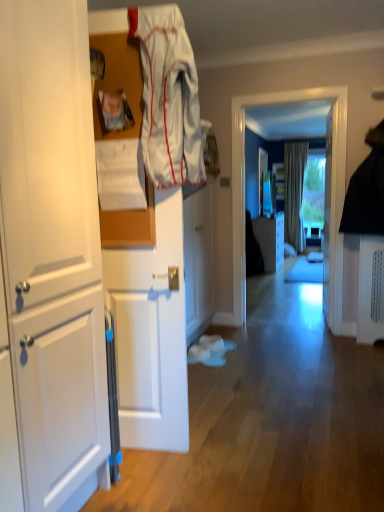
Question: Should I look upward or downward to see matte white cabinet at center, acting as the 1th cabinetry starting from the back?

Choices:
 (A) down
 (B) up

Answer: (B)

Question: From the image's perspective, is matte white cabinet at center, which ranks as the 3th cabinetry in left-to-right order, above transparent glass window at center?

Choices:
 (A) no
 (B) yes

Answer: (A)

Question: Considering the relative sizes of matte white cabinet at center, acting as the 1th cabinetry starting from the back, and transparent glass window at center in the image provided, is matte white cabinet at center, acting as the 1th cabinetry starting from the back, taller than transparent glass window at center?

Choices:
 (A) no
 (B) yes

Answer: (A)

Question: Does matte white cabinet at center, placed as the first cabinetry when sorted from right to left, have a larger size compared to transparent glass window at center?

Choices:
 (A) no
 (B) yes

Answer: (B)

Question: From the image's perspective, is matte white cabinet at center, acting as the 1th cabinetry starting from the back, located beneath transparent glass window at center?

Choices:
 (A) no
 (B) yes

Answer: (B)

Question: Considering the relative positions of matte white cabinet at center, acting as the 1th cabinetry starting from the back, and transparent glass window at center in the image provided, is matte white cabinet at center, acting as the 1th cabinetry starting from the back, to the left of transparent glass window at center from the viewer's perspective?

Choices:
 (A) yes
 (B) no

Answer: (B)

Question: From a real-world perspective, is matte white cabinet at center, the third cabinetry from the front, on transparent glass window at center?

Choices:
 (A) no
 (B) yes

Answer: (A)

Question: Is white matte cabinet at left, placed as the 1th cabinetry when sorted from front to back, surrounded by matte white cabinet at center, placed as the first cabinetry when sorted from right to left?

Choices:
 (A) yes
 (B) no

Answer: (B)

Question: From a real-world perspective, is matte white cabinet at center, acting as the 1th cabinetry starting from the back, located beneath white matte cabinet at left, the 3th cabinetry viewed from the right?

Choices:
 (A) no
 (B) yes

Answer: (B)

Question: Does matte white cabinet at center, placed as the first cabinetry when sorted from right to left, turn towards white matte cabinet at left, the 1th cabinetry when ordered from left to right?

Choices:
 (A) no
 (B) yes

Answer: (A)

Question: Is matte white cabinet at center, placed as the first cabinetry when sorted from right to left, behind white matte cabinet at left, marked as the 3th cabinetry in a back-to-front arrangement?

Choices:
 (A) no
 (B) yes

Answer: (B)

Question: Is matte white cabinet at center, placed as the first cabinetry when sorted from right to left, far from white matte cabinet at left, marked as the 3th cabinetry in a back-to-front arrangement?

Choices:
 (A) yes
 (B) no

Answer: (A)

Question: From a real-world perspective, is matte white cabinet at center, which ranks as the 3th cabinetry in left-to-right order, over white matte cabinet at left, the 1th cabinetry when ordered from left to right?

Choices:
 (A) yes
 (B) no

Answer: (B)

Question: Could white glossy door at center be considered to be inside white matte cabinet at left, placed as the 1th cabinetry when sorted from front to back?

Choices:
 (A) no
 (B) yes

Answer: (A)